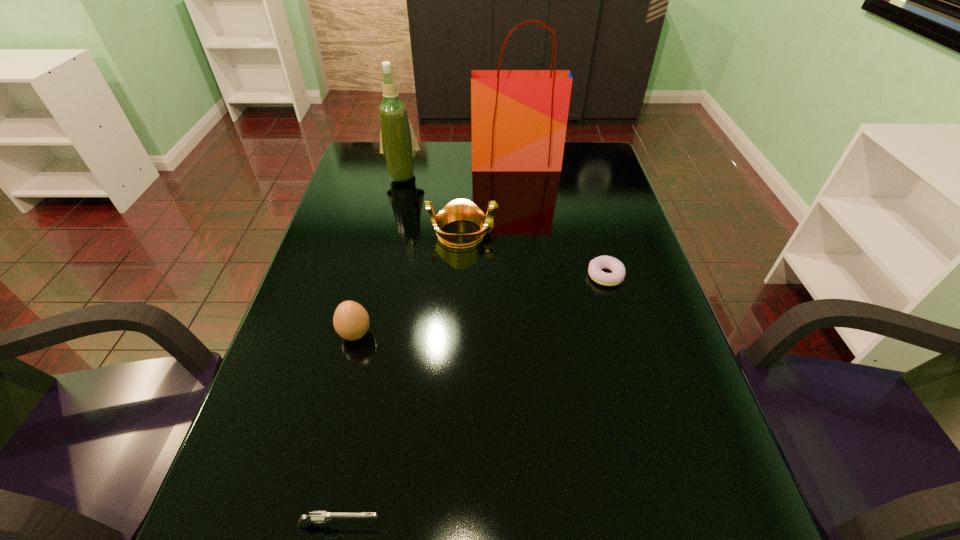
Identify the location of shopping bag. (519, 118).

What are the coordinates of `the second tallest object` in the screenshot? It's located at (398, 143).

Where is `tiara`? tiara is located at coordinates (460, 209).

Find the location of a particular element. The image size is (960, 540). the second nearest object is located at coordinates (351, 321).

In order to click on the second shortest object in this screenshot , I will do pos(317,516).

Locate an element on the screen. This screenshot has height=540, width=960. the nearest object is located at coordinates (317, 516).

The height and width of the screenshot is (540, 960). I want to click on the rightmost object, so click(602, 262).

The height and width of the screenshot is (540, 960). I want to click on the shortest object, so click(x=602, y=262).

Identify the location of vacant space located on the handle side of the shopping bag. (520, 204).

Where is `free space located on the front-facing side of the wine bottle`? This screenshot has height=540, width=960. free space located on the front-facing side of the wine bottle is located at coordinates (386, 248).